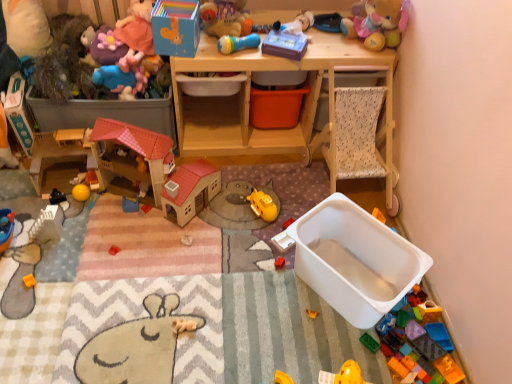
You are a GUI agent. You are given a task and a screenshot of the screen. Output one action in this format:
    pyautogui.click(x=<x>, y=<y>)
    Task: Click on the vacant space to the right of yellow matte submarine at center, which appears as the fourth toy when viewed from the right
    The height and width of the screenshot is (384, 512).
    Given the screenshot: What is the action you would take?
    pyautogui.click(x=298, y=206)